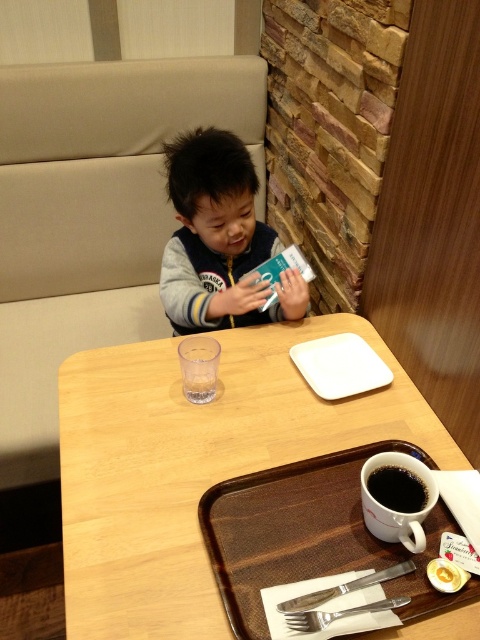
Which is more to the left, brown textured tray at lower center or smooth yellow egg at lower right?

Positioned to the left is brown textured tray at lower center.

Is point (228, 572) positioned after point (452, 588)?

Yes.

Find the location of `brown textured tray at lower center`. brown textured tray at lower center is located at coordinates (312, 536).

I want to click on brown textured tray at lower center, so click(312, 536).

The height and width of the screenshot is (640, 480). What do you see at coordinates (218, 240) in the screenshot? I see `matte gray jacket at center` at bounding box center [218, 240].

This screenshot has height=640, width=480. I want to click on matte gray jacket at center, so click(218, 240).

Is point (112, 566) in front of point (388, 474)?

Yes.

Where is `wooden tray at center`? wooden tray at center is located at coordinates (195, 465).